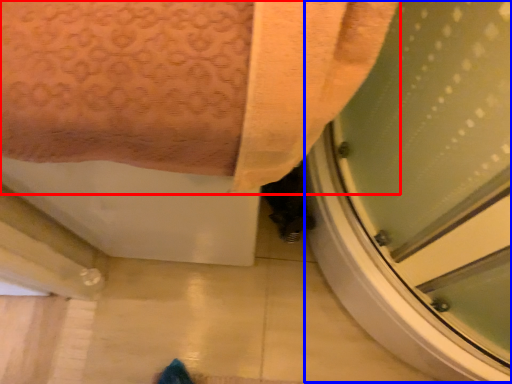
Question: Which object is further to the camera taking this photo, towel (highlighted by a red box) or screen door (highlighted by a blue box)?

Choices:
 (A) towel
 (B) screen door

Answer: (B)